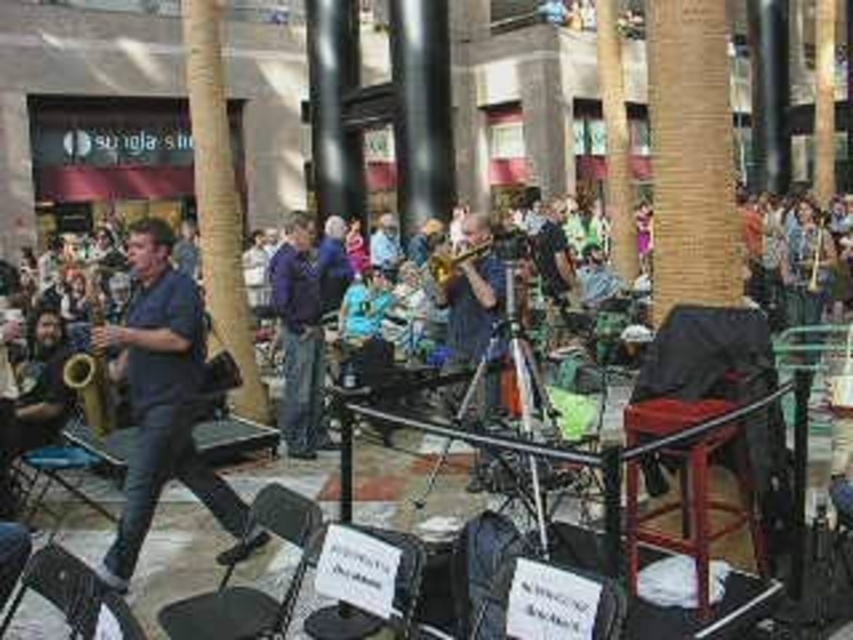
You are a spectator at the performance. You notice the wooden chair at center and the gold brass saxophone at left. Which object is closer to you?

The wooden chair at center is closer to you because it is in front of the gold brass saxophone at left.

You are standing in the plaza and want to walk from point A to point B. Point A is at coordinates point (161, 618) and point B is at coordinates point (90, 570). Since you can only move forward, will you be moving towards or away from the band as you go from A to B?

Result: Since point A is further to the viewer than point B, moving from A to B means moving away from the band.

You are attending a live music performance in the plaza. You see a wooden chair at center and a gold brass saxophone at left. Which object is positioned lower in the scene?

The wooden chair at center is positioned lower than the gold brass saxophone at left.